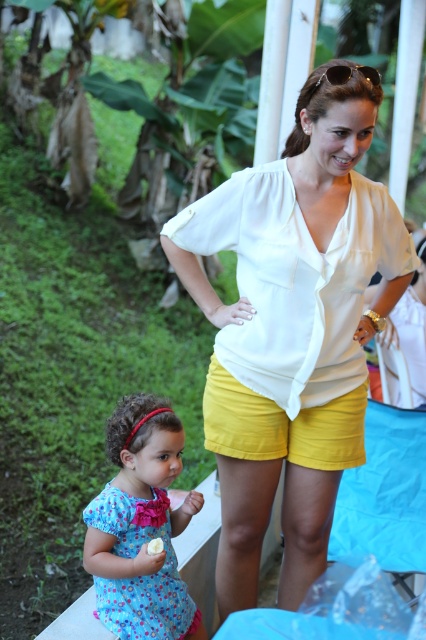
Based on the photo, you are a photographer trying to capture the white silky blouse at center in the image. The camera is set to focus on the point at coordinates point (293,326). Is this point likely to be on the white silky blouse at center?

Yes, the point (293,326) corresponds to the white silky blouse at center, so the focus is correctly placed on the white silky blouse at center.

You are a photographer standing in the scene and want to take a photo of both the white silky blouse at center and the white creamy banana at lower center in the same frame. Given that your camera has a minimum focus distance of 1 meter, can you capture both objects clearly in the photo?

The white silky blouse at center and white creamy banana at lower center are 1.02 meters apart from each other. Since the distance between them is just over 1 meter, your camera can focus on both objects as they are within the minimum focus distance requirement.

You are a photographer trying to capture the blue floral dress at lower left and the white creamy banana at lower center in the same frame. Based on their positions, which object is closer to the camera?

The blue floral dress at lower left is closer to the camera because the white creamy banana at lower center is behind it.